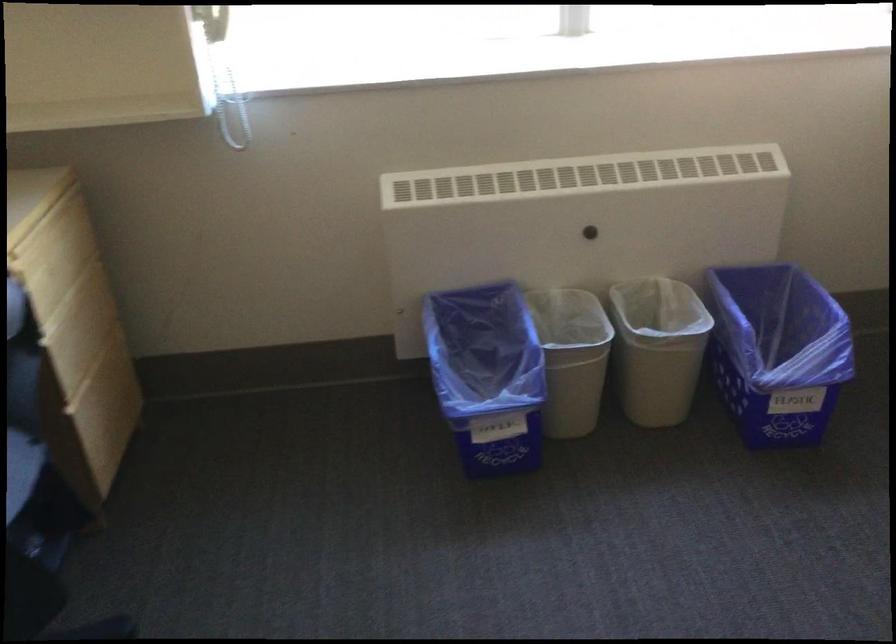
Question: The camera is either moving clockwise (left) or counter-clockwise (right) around the object. The first image is from the beginning of the video and the second image is from the end. Is the camera moving left or right when shooting the video?

Choices:
 (A) Left
 (B) Right

Answer: (B)